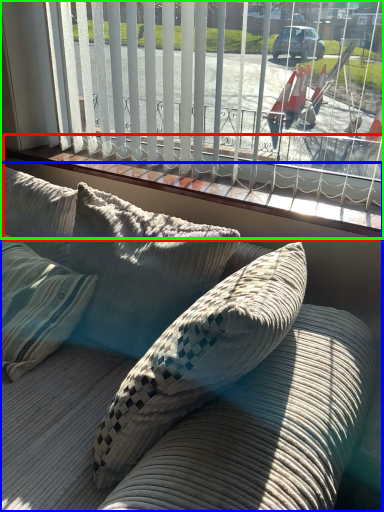
Question: Which is farther away from window sill (highlighted by a red box)? studio couch (highlighted by a blue box) or window (highlighted by a green box)?

Choices:
 (A) studio couch
 (B) window

Answer: (A)